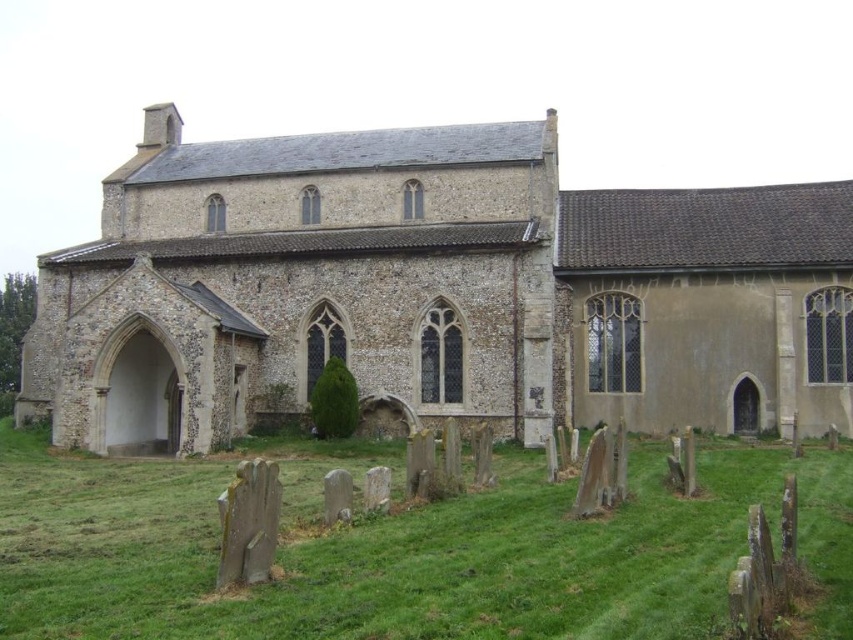
Which is in front, point (608, 340) or point (824, 618)?

Point (824, 618) is in front.

Who is positioned more to the right, stone church at lower left or green grass at lower left?

From the viewer's perspective, stone church at lower left appears more on the right side.

Does point (373, 396) come behind point (477, 604)?

Yes, point (373, 396) is farther from viewer.

The height and width of the screenshot is (640, 853). I want to click on stone church at lower left, so click(434, 291).